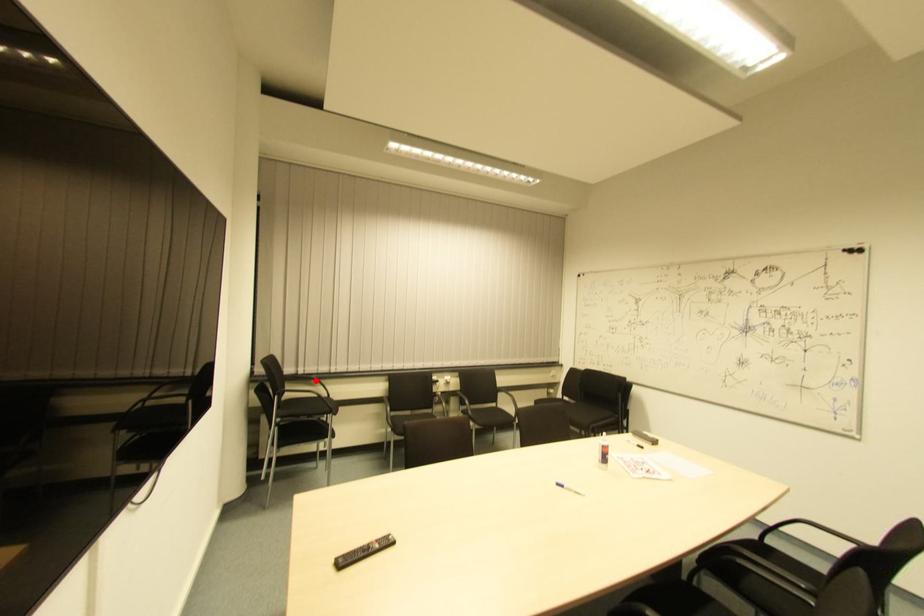
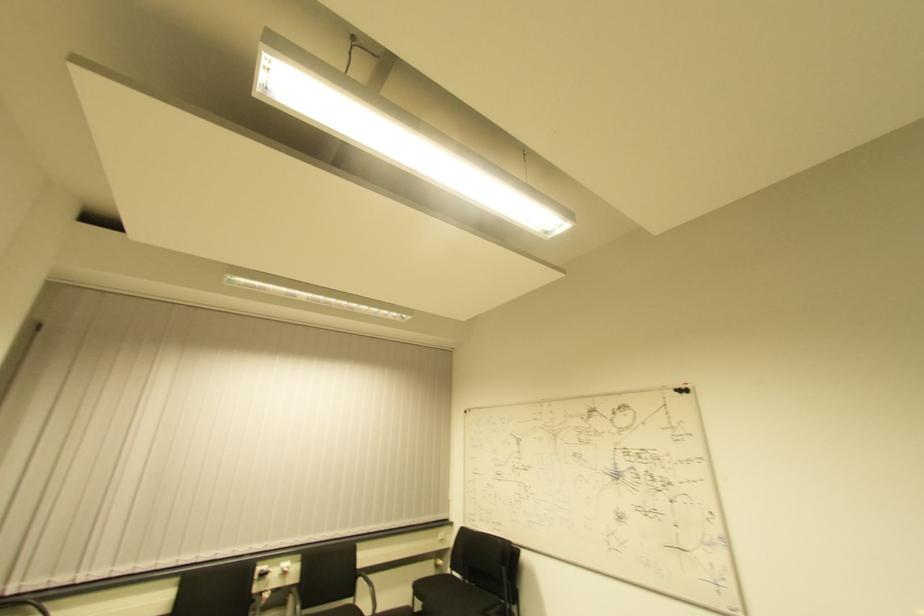
Question: I am providing you with two images of the same scene from different viewpoints. Given a red point in image1, look at the same physical point in image2. Is it:

Choices:
 (A) Closer to the viewpoint
 (B) Farther from the viewpoint

Answer: (A)